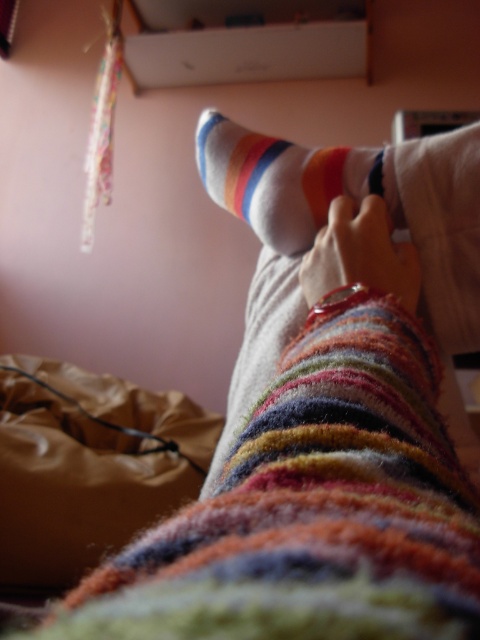
You are trying to decide which pair of socks to wear today. You see the white striped sock at center and the multicolored fuzzy socks at center. Which one is closer to you?

The white striped sock at center is closer to you because it is further to the viewer than the multicolored fuzzy socks at center.

You are trying to choose between two pairs of socks displayed in a store. You notice the multicolored fuzzy socks at center and the matte striped sock at center. Which pair has a wider width?

The multicolored fuzzy socks at center has a larger width than the matte striped sock at center according to the description.